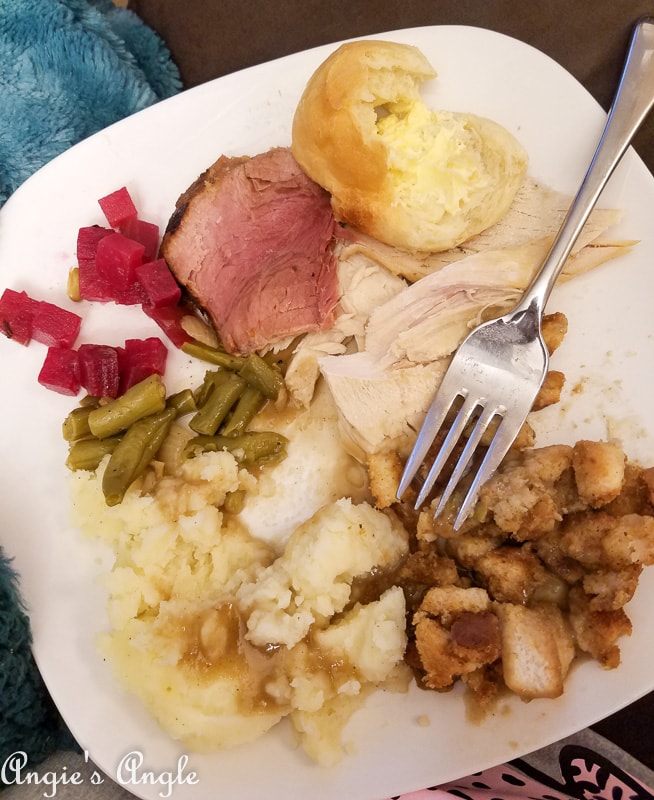
I want to click on stuffing, so click(530, 645), click(585, 494), click(522, 514).